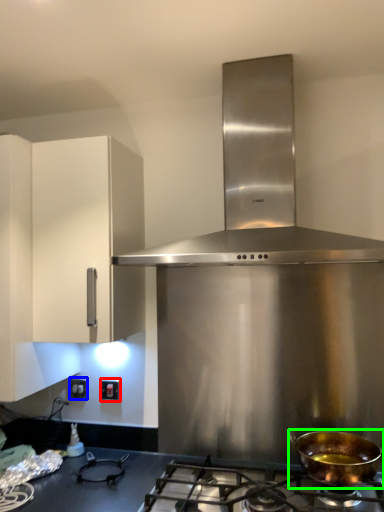
Question: Estimate the real-world distances between objects in this image. Which object is closer to electric outlet (highlighted by a red box), electric outlet (highlighted by a blue box) or kitchen appliance (highlighted by a green box)?

Choices:
 (A) electric outlet
 (B) kitchen appliance

Answer: (A)